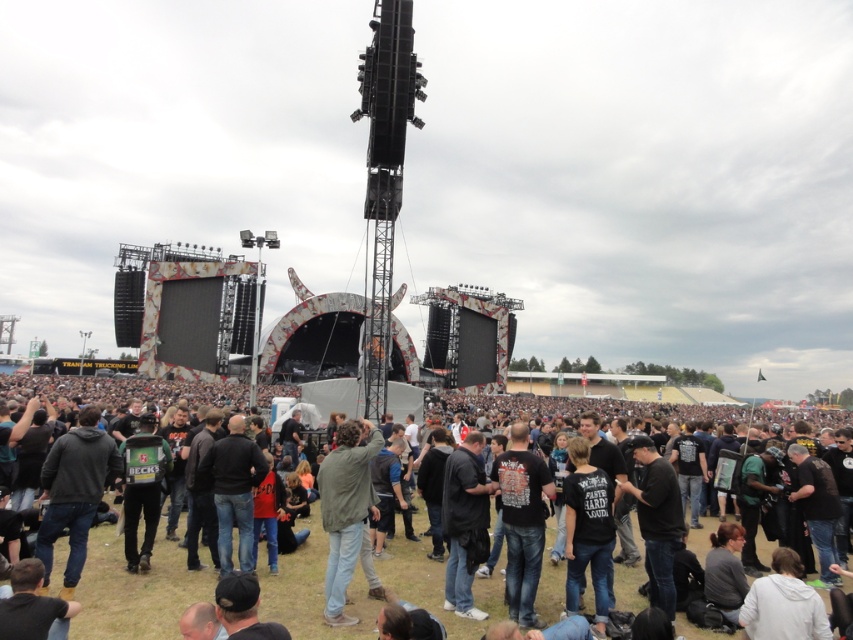
Is the position of green matte jacket at center more distant than that of black matte jacket at center?

No, green matte jacket at center is closer to the viewer.

Which is behind, point (372, 444) or point (462, 573)?

Positioned behind is point (372, 444).

The height and width of the screenshot is (640, 853). I want to click on green matte jacket at center, so click(345, 509).

Is dark gray clothing at center thinner than black matte jacket at center?

Incorrect, dark gray clothing at center's width is not less than black matte jacket at center's.

Can you confirm if dark gray clothing at center is positioned above black matte jacket at center?

Yes.

Who is more forward, [553,579] or [456,532]?

Point [553,579]

This screenshot has height=640, width=853. Find the location of `dark gray clothing at center`. dark gray clothing at center is located at coordinates (134, 589).

What are the coordinates of `green matte jacket at center` in the screenshot? It's located at (345, 509).